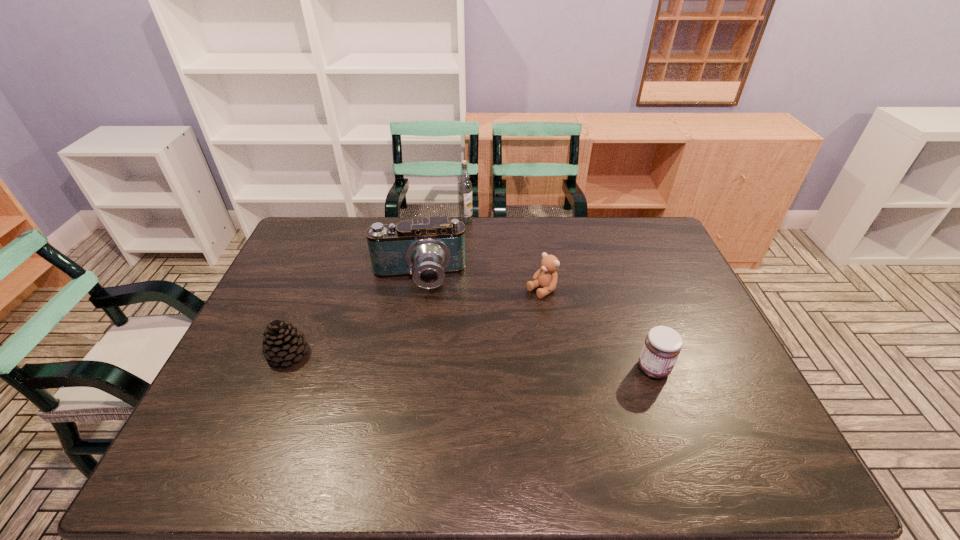
Find the location of a particular element. free space at the near edge of the desktop is located at coordinates (292, 408).

Image resolution: width=960 pixels, height=540 pixels. Identify the location of free space at the left edge of the desktop. (326, 273).

The height and width of the screenshot is (540, 960). Find the location of `vacant area at the right edge`. vacant area at the right edge is located at coordinates (645, 266).

In the image, there is a desktop. Identify the location of vacant space at the near left corner. The width and height of the screenshot is (960, 540). (237, 401).

This screenshot has height=540, width=960. What are the coordinates of `vacant region at the far right corner of the desktop` in the screenshot? It's located at (651, 253).

Identify the location of vacant region at the near right corner of the desktop. The image size is (960, 540). (719, 427).

Locate an element on the screen. The height and width of the screenshot is (540, 960). free space between the camcorder and the jam is located at coordinates (536, 323).

The width and height of the screenshot is (960, 540). I want to click on free spot between the teddy bear and the rightmost object, so click(x=597, y=329).

Where is `free area in between the vodka and the leftmost object`? free area in between the vodka and the leftmost object is located at coordinates (376, 287).

Locate an element on the screen. This screenshot has height=540, width=960. empty space that is in between the pinecone and the vodka is located at coordinates click(376, 287).